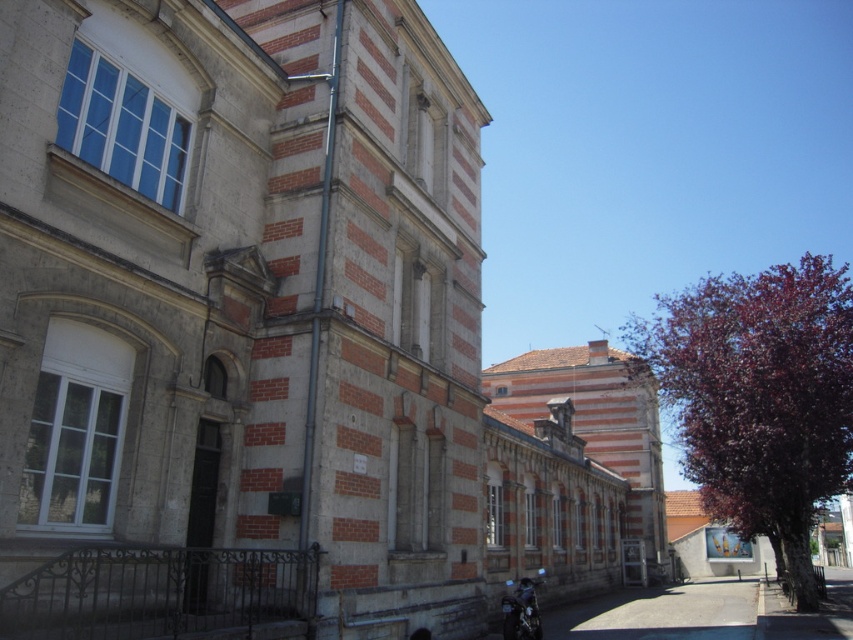
You are standing in front of the historic building and see a point marked at coordinates (317, 292). Based on the building description, can you identify what this point is located on?

The point at coordinates (317, 292) is located on the metallic pipe at center.

You are a delivery person trying to reach the shiny black motorcycle at lower right parked behind the metallic pipe at center. Can you easily access the motorcycle without moving the pipe?

The metallic pipe at center is in front of the shiny black motorcycle at lower right, so the motorcycle is blocked by the pipe. You will need to move the pipe to access it.